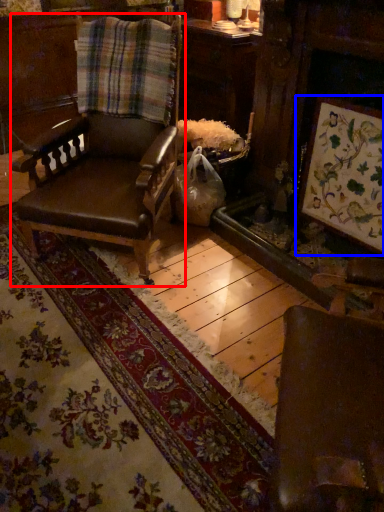
Question: Which point is closer to the camera, chair (highlighted by a red box) or picture frame (highlighted by a blue box)?

Choices:
 (A) chair
 (B) picture frame

Answer: (A)